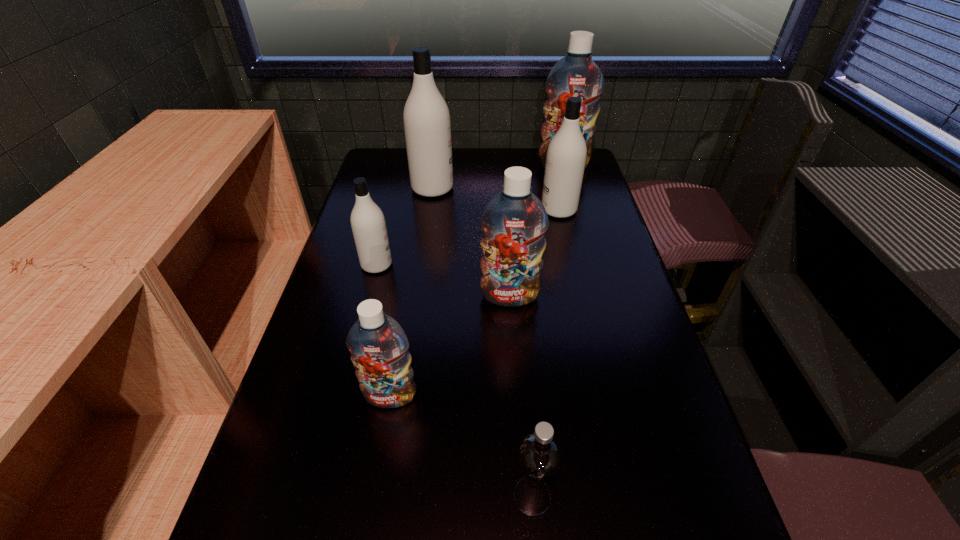
Identify the location of vodka. (539, 457).

Locate an element on the screen. The width and height of the screenshot is (960, 540). the nearest object is located at coordinates (539, 457).

Find the location of a particular element. Image resolution: width=960 pixels, height=540 pixels. vacant area situated 0.270m on the front-facing side of the second white shampoo from right to left is located at coordinates (532, 188).

Where is `free point located on the front label of the biggest blue shampoo`? Image resolution: width=960 pixels, height=540 pixels. free point located on the front label of the biggest blue shampoo is located at coordinates (582, 231).

Image resolution: width=960 pixels, height=540 pixels. Identify the location of vacant position located on the front-facing side of the rightmost white shampoo. (525, 210).

Find the location of a particular element. vacant region located 0.320m on the front-facing side of the rightmost white shampoo is located at coordinates (443, 210).

Where is `free space located 0.240m on the front-facing side of the rightmost white shampoo`? The height and width of the screenshot is (540, 960). free space located 0.240m on the front-facing side of the rightmost white shampoo is located at coordinates (467, 210).

The height and width of the screenshot is (540, 960). I want to click on free region located 0.070m on the front label of the third nearest object, so click(513, 329).

Find the location of `vacant space located 0.190m on the front-facing side of the smallest white shampoo`. vacant space located 0.190m on the front-facing side of the smallest white shampoo is located at coordinates (460, 265).

Find the location of a particular element. vacant region located on the front label of the second nearest object is located at coordinates pos(376,478).